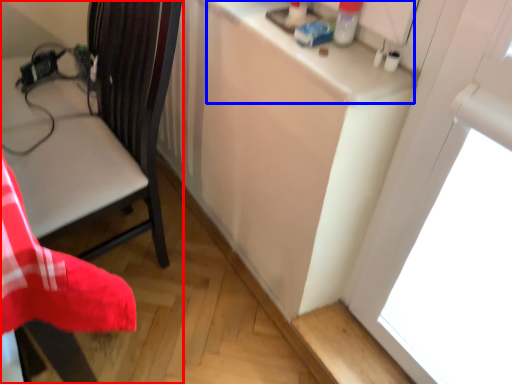
Question: Which point is closer to the camera, chair (highlighted by a red box) or counter top (highlighted by a blue box)?

Choices:
 (A) chair
 (B) counter top

Answer: (A)